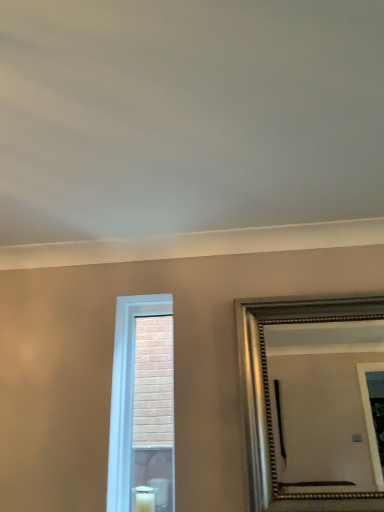
Question: Should I look upward or downward to see silver metallic mirror at right?

Choices:
 (A) down
 (B) up

Answer: (A)

Question: Is silver metallic mirror at right not inside white wax candle at lower center?

Choices:
 (A) no
 (B) yes

Answer: (B)

Question: From a real-world perspective, is silver metallic mirror at right on white wax candle at lower center?

Choices:
 (A) no
 (B) yes

Answer: (B)

Question: Is silver metallic mirror at right at the left side of white wax candle at lower center?

Choices:
 (A) no
 (B) yes

Answer: (A)

Question: Is silver metallic mirror at right shorter than white wax candle at lower center?

Choices:
 (A) no
 (B) yes

Answer: (A)

Question: Is white wax candle at lower center inside silver metallic mirror at right?

Choices:
 (A) no
 (B) yes

Answer: (A)

Question: Does silver metallic mirror at right come behind white wax candle at lower center?

Choices:
 (A) yes
 (B) no

Answer: (B)

Question: Is white wax candle at lower center not near white glass window at center?

Choices:
 (A) no
 (B) yes

Answer: (A)

Question: From a real-world perspective, is white wax candle at lower center positioned over white glass window at center based on gravity?

Choices:
 (A) yes
 (B) no

Answer: (B)

Question: From the image's perspective, is white wax candle at lower center over white glass window at center?

Choices:
 (A) yes
 (B) no

Answer: (B)

Question: Is white wax candle at lower center not inside white glass window at center?

Choices:
 (A) yes
 (B) no

Answer: (A)

Question: Considering the relative sizes of white wax candle at lower center and white glass window at center in the image provided, is white wax candle at lower center bigger than white glass window at center?

Choices:
 (A) no
 (B) yes

Answer: (A)

Question: Considering the relative sizes of white wax candle at lower center and white glass window at center in the image provided, is white wax candle at lower center wider than white glass window at center?

Choices:
 (A) yes
 (B) no

Answer: (A)

Question: Is white wax candle at lower center closer to the viewer compared to silver metallic mirror at right?

Choices:
 (A) no
 (B) yes

Answer: (A)